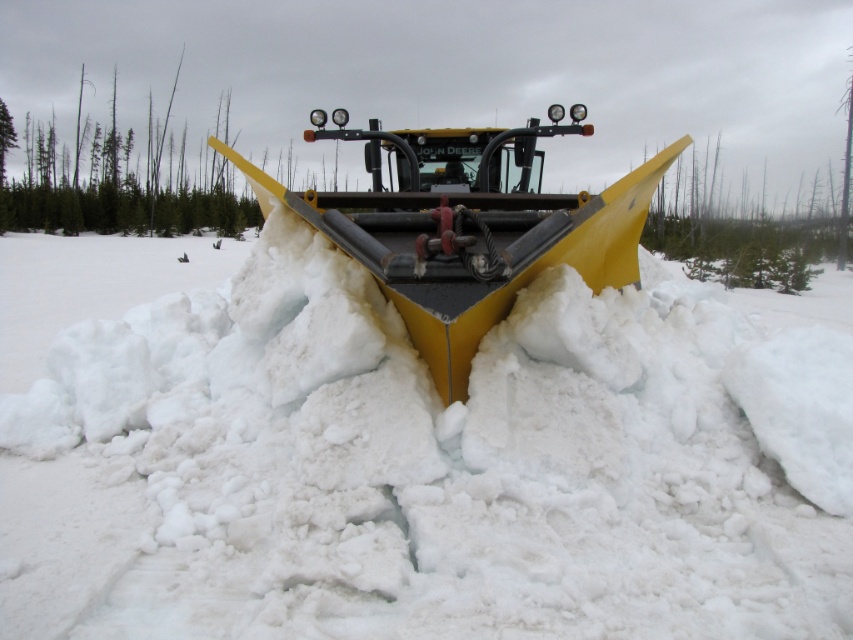
You are a farmer who needs to clear the snow from your field. You have a John Deere tractor with a yellow matte snowplow at center. The white fluffy snow at center is in your way. Can the snowplow clear the snow easily?

The white fluffy snow at center has a lesser height compared to the yellow matte snowplow at center, so the snowplow can clear the snow easily since it is taller than the snow.

You are a farmer who needs to clear snow from the path in front of the yellow matte snowplow at center. According to the image, where is the white fluffy snow at center located relative to the snowplow?

The white fluffy snow at center is to the left of the yellow matte snowplow at center, so it is positioned to the left side of the snowplow.